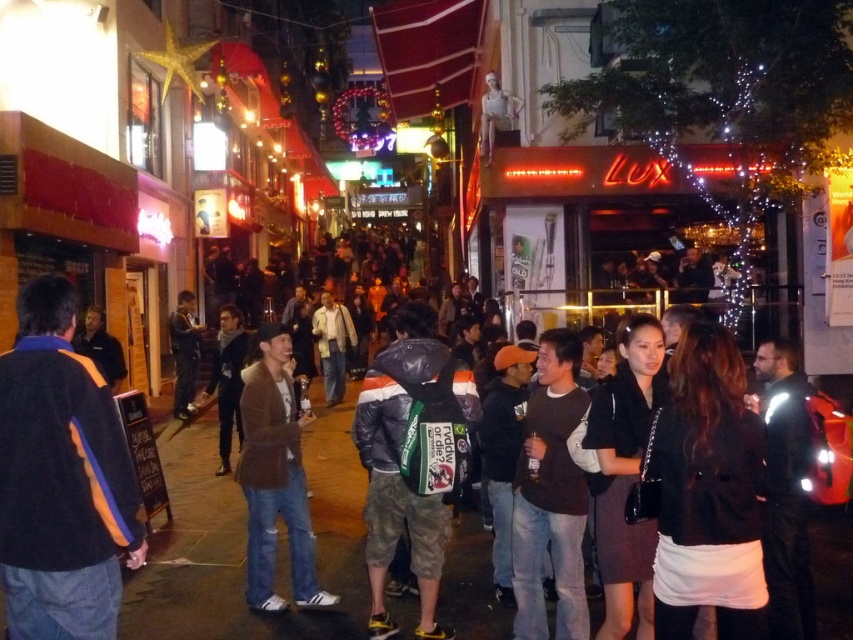
Question: Which point is closer to the camera?

Choices:
 (A) dark blue fleece jacket at left
 (B) dark blue jeans at center
 (C) camouflage fabric backpack at center

Answer: (A)

Question: Which is farther from the brown cotton jacket at center?

Choices:
 (A) camouflage fabric backpack at center
 (B) dark blue fleece jacket at left
 (C) dark blue jeans at center

Answer: (C)

Question: Is camouflage fabric backpack at center positioned in front of dark blue jeans at center?

Choices:
 (A) no
 (B) yes

Answer: (B)

Question: Is dark blue fleece jacket at left positioned before dark blue jeans at center?

Choices:
 (A) yes
 (B) no

Answer: (A)

Question: Which of these objects is positioned farthest from the dark blue fleece jacket at left?

Choices:
 (A) brown cotton jacket at center
 (B) dark blue jeans at center
 (C) camouflage fabric backpack at center

Answer: (B)

Question: Can you confirm if camouflage fabric backpack at center is positioned to the right of dark blue jeans at center?

Choices:
 (A) yes
 (B) no

Answer: (A)